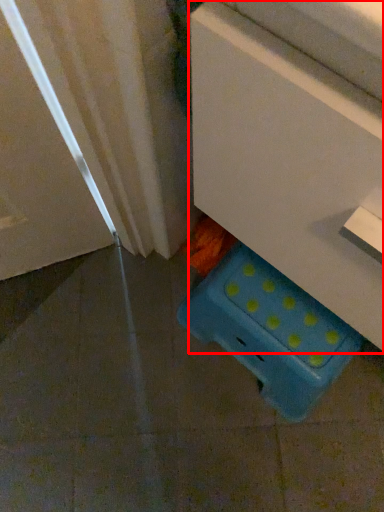
Question: From the image's perspective, what is the correct spatial positioning of furniture (annotated by the red box) in reference to storage box?

Choices:
 (A) above
 (B) below

Answer: (A)